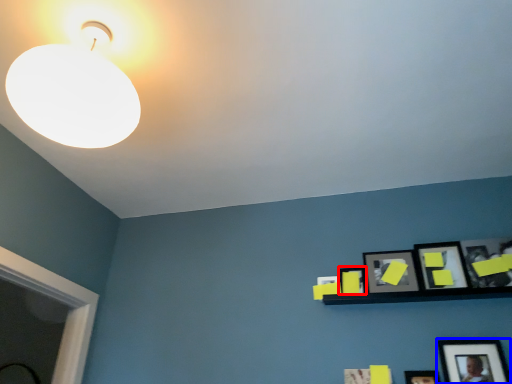
Question: Among these objects, which one is farthest to the camera, picture frame (highlighted by a red box) or picture frame (highlighted by a blue box)?

Choices:
 (A) picture frame
 (B) picture frame

Answer: (A)